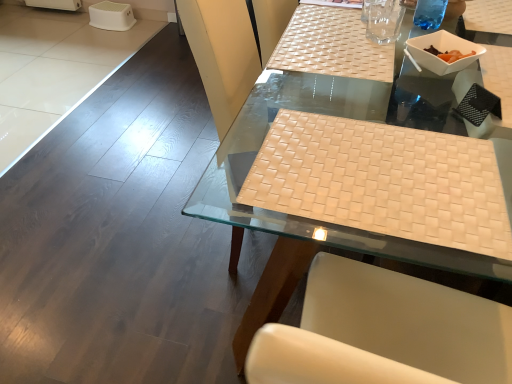
Question: Considering the relative positions of white plastic bowl at upper right and white woven placemat at center in the image provided, is white plastic bowl at upper right behind white woven placemat at center?

Choices:
 (A) no
 (B) yes

Answer: (B)

Question: Can you confirm if white plastic bowl at upper right is wider than white woven placemat at center?

Choices:
 (A) no
 (B) yes

Answer: (A)

Question: Can you confirm if white plastic bowl at upper right is positioned to the right of white woven placemat at center?

Choices:
 (A) yes
 (B) no

Answer: (B)

Question: From the image's perspective, is white plastic bowl at upper right over white woven placemat at center?

Choices:
 (A) yes
 (B) no

Answer: (A)

Question: From the image's perspective, would you say white plastic bowl at upper right is shown under white woven placemat at center?

Choices:
 (A) no
 (B) yes

Answer: (A)

Question: Is point (445, 67) closer or farther from the camera than point (388, 69)?

Choices:
 (A) closer
 (B) farther

Answer: (A)

Question: Is white plastic bowl at upper right bigger or smaller than white woven placemat at center?

Choices:
 (A) small
 (B) big

Answer: (A)

Question: Relative to white woven placemat at center, is white plastic bowl at upper right in front or behind?

Choices:
 (A) behind
 (B) front

Answer: (A)

Question: Based on their positions, is white plastic bowl at upper right located to the left or right of white woven placemat at center?

Choices:
 (A) left
 (B) right

Answer: (A)

Question: Does point (424, 150) appear closer or farther from the camera than point (500, 147)?

Choices:
 (A) farther
 (B) closer

Answer: (B)

Question: Considering the positions of beige woven mat at center and white woven placemat at center in the image, is beige woven mat at center taller or shorter than white woven placemat at center?

Choices:
 (A) short
 (B) tall

Answer: (A)

Question: Is beige woven mat at center in front of or behind white woven placemat at center in the image?

Choices:
 (A) front
 (B) behind

Answer: (B)

Question: Is beige woven mat at center spatially inside white woven placemat at center, or outside of it?

Choices:
 (A) inside
 (B) outside

Answer: (A)

Question: Considering the positions of white plastic bowl at upper right and transparent glass at upper center in the image, is white plastic bowl at upper right bigger or smaller than transparent glass at upper center?

Choices:
 (A) big
 (B) small

Answer: (A)

Question: From the image's perspective, is white plastic bowl at upper right above or below transparent glass at upper center?

Choices:
 (A) below
 (B) above

Answer: (A)